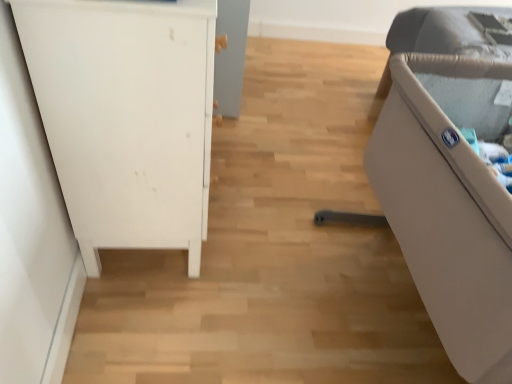
Find the location of `free space in front of white matte cabinet at left, positioned as the 1th furniture in left-to-right order`. free space in front of white matte cabinet at left, positioned as the 1th furniture in left-to-right order is located at coordinates (181, 326).